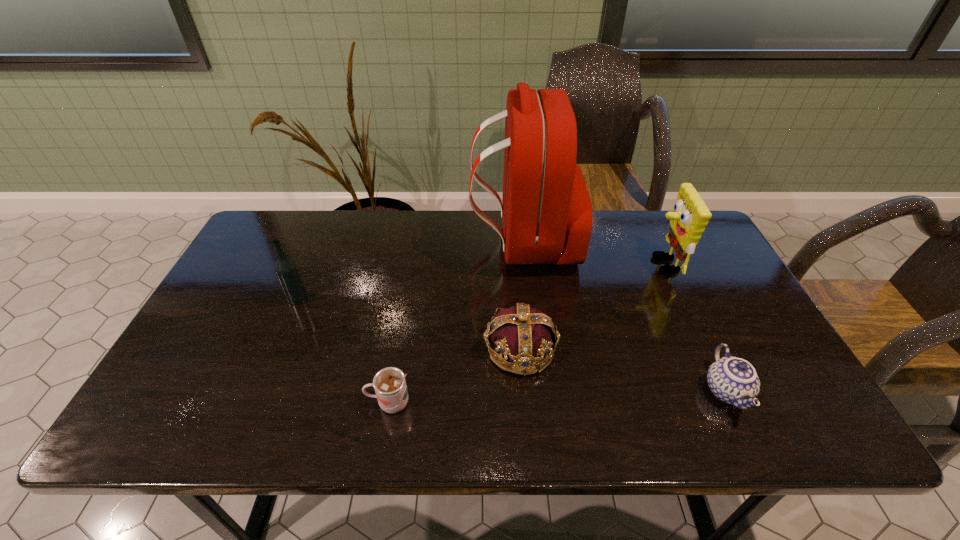
At what (x,y) coordinates should I click in order to perform the action: click on free space at the far left corner of the desktop. Please return your answer as a coordinate pair (x, y). This screenshot has width=960, height=540. Looking at the image, I should click on (300, 238).

Find the location of a particular element. The image size is (960, 540). free point at the far right corner is located at coordinates (651, 213).

Image resolution: width=960 pixels, height=540 pixels. I want to click on free space between the backpack and the fifth shortest object, so click(x=592, y=253).

Locate an element on the screen. This screenshot has width=960, height=540. free space between the crown and the chinaware is located at coordinates (623, 369).

Identify the location of free spot between the crown and the backpack. The height and width of the screenshot is (540, 960). (521, 295).

This screenshot has height=540, width=960. Find the location of `vacant space that's between the backpack and the crown`. vacant space that's between the backpack and the crown is located at coordinates (521, 295).

This screenshot has width=960, height=540. I want to click on vacant area that lies between the third farthest object and the fifth object from right to left, so click(344, 350).

You are a GUI agent. You are given a task and a screenshot of the screen. Output one action in this format:
    pyautogui.click(x=<x>, y=<y>)
    Task: Click on the free point between the crown and the leftmost object
    This screenshot has width=960, height=540.
    Given the screenshot: What is the action you would take?
    pyautogui.click(x=409, y=323)

Image resolution: width=960 pixels, height=540 pixels. In order to click on free spot between the fifth object from right to left and the tallest object in this screenshot , I will do `click(456, 322)`.

The width and height of the screenshot is (960, 540). I want to click on object that can be found as the second closest to the backpack, so click(x=690, y=217).